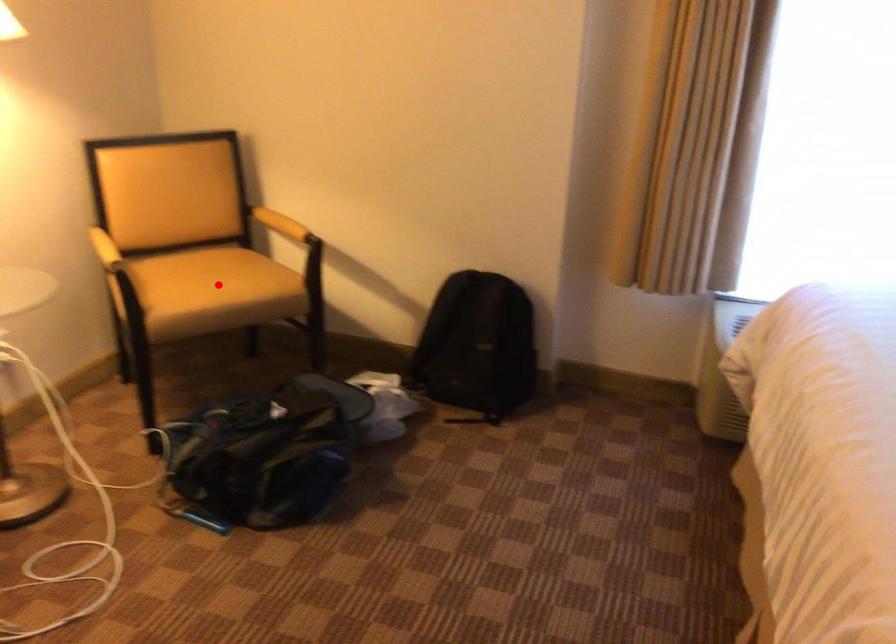
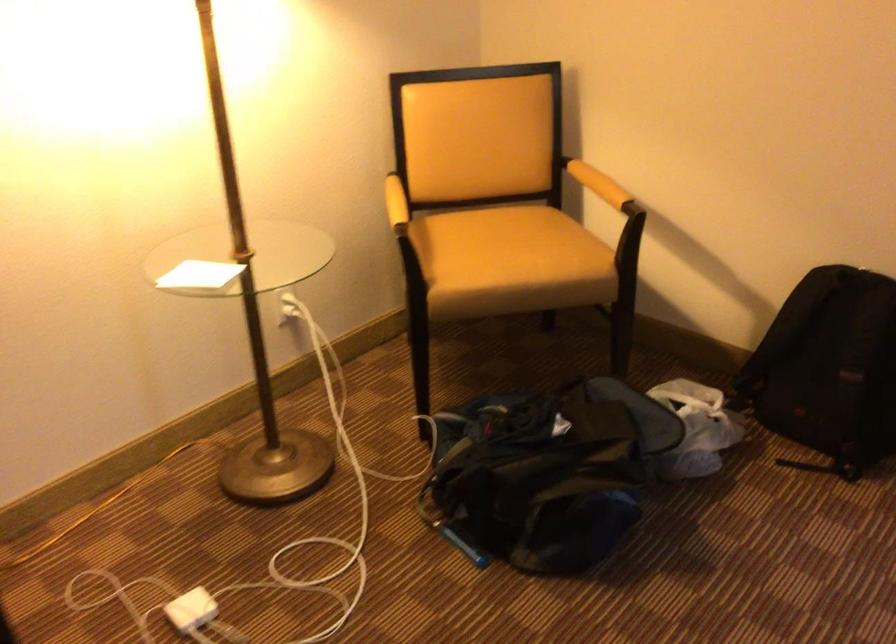
Locate, in the second image, the point that corresponds to the highlighted location in the first image.

(510, 261)